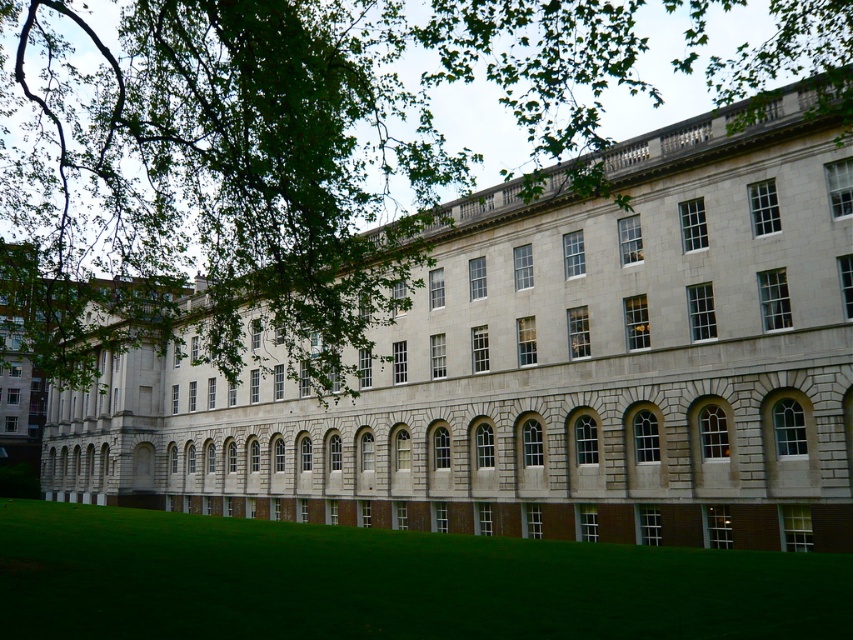
Between gray stone building at center and green grass at lower center, which one has less height?

green grass at lower center

Can you confirm if gray stone building at center is taller than green grass at lower center?

Correct, gray stone building at center is much taller as green grass at lower center.

Where is `gray stone building at center`? The image size is (853, 640). gray stone building at center is located at coordinates (546, 369).